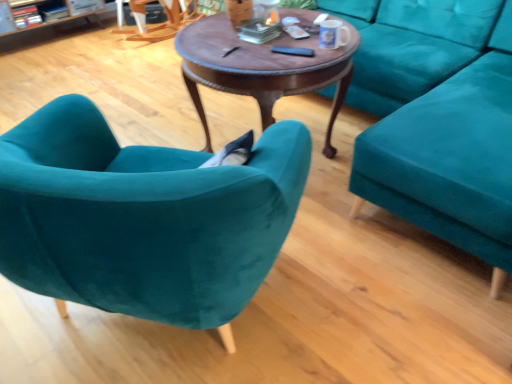
Where is `free space to the left of white plastic remote control at center, the 2th remote control in the bottom-to-top sequence`? This screenshot has width=512, height=384. free space to the left of white plastic remote control at center, the 2th remote control in the bottom-to-top sequence is located at coordinates (256, 31).